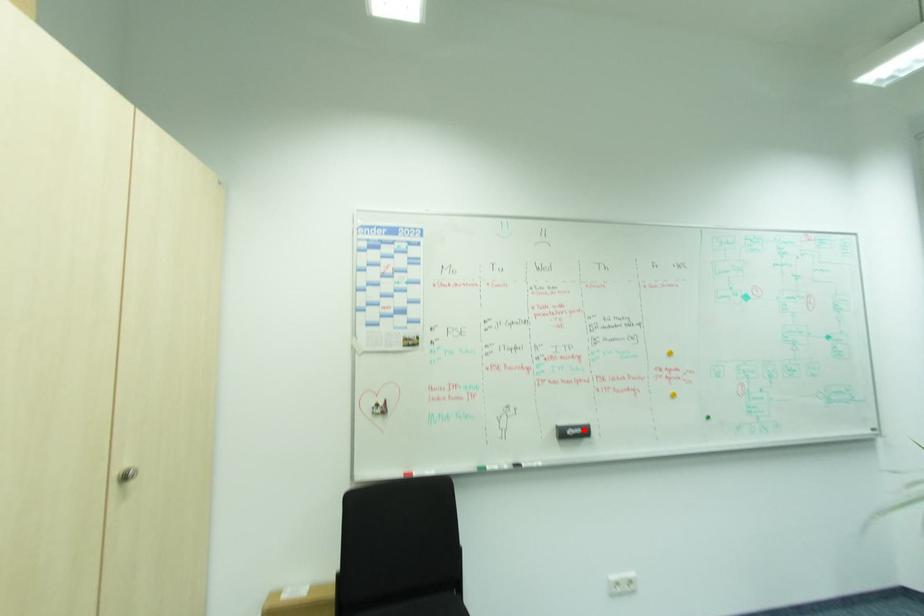
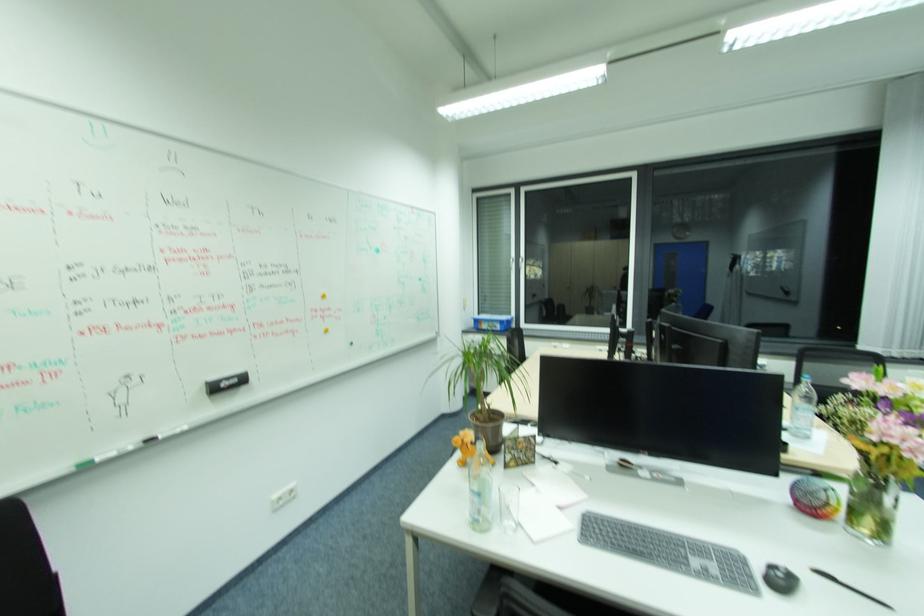
Locate, in the second image, the point that corresponds to the highlighted location in the first image.

(240, 381)